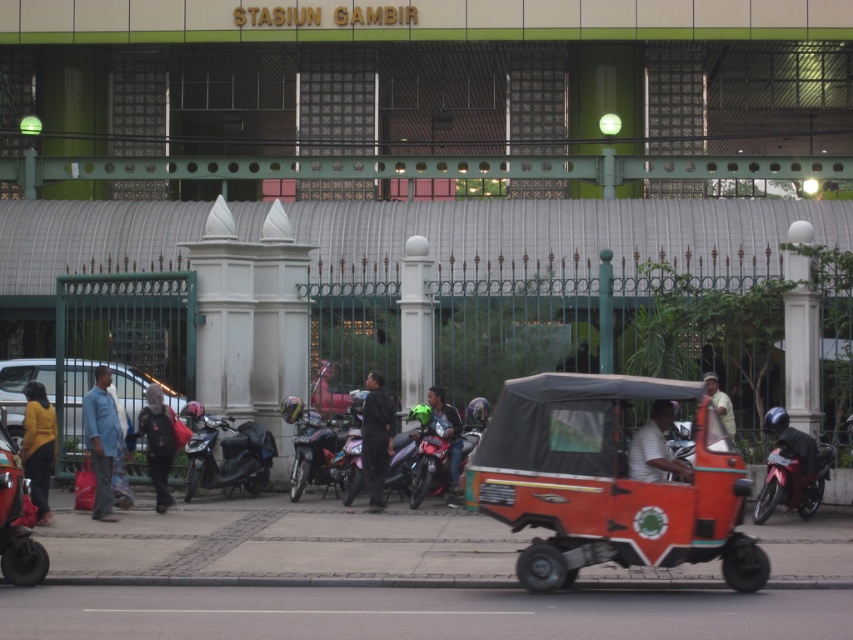
Question: Is metallic silver motorcycle at center wider than green matte helmet at center?

Choices:
 (A) no
 (B) yes

Answer: (B)

Question: Which of the following is the farthest from the observer?

Choices:
 (A) green matte helmet at center
 (B) metallic silver motorcycle at center

Answer: (B)

Question: Among these points, which one is farthest from the camera?

Choices:
 (A) (202, 436)
 (B) (370, 486)

Answer: (A)

Question: Can you confirm if matte blue car at left is positioned above dark blue fabric jacket at center?

Choices:
 (A) no
 (B) yes

Answer: (B)

Question: Can you confirm if matte blue car at left is positioned to the right of metallic silver scooter at center?

Choices:
 (A) no
 (B) yes

Answer: (A)

Question: Which point is farther from the camera taking this photo?

Choices:
 (A) (102, 468)
 (B) (422, 492)
 (C) (297, 419)

Answer: (C)